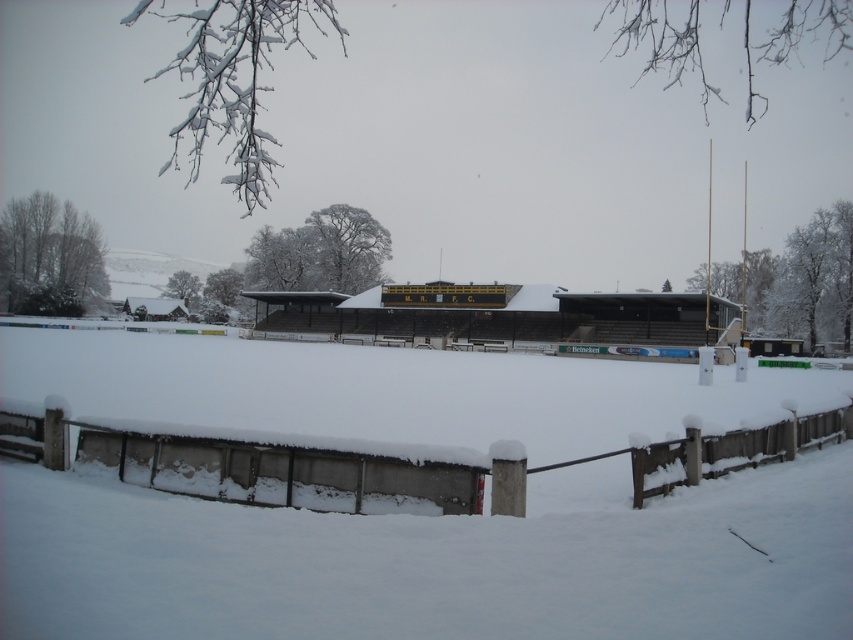
Question: Which object appears closest to the camera in this image?

Choices:
 (A) snow-covered wooden fence at lower center
 (B) dark brown wooden hut at center

Answer: (A)

Question: Is snow-covered wooden fence at lower center below dark brown wooden hut at center?

Choices:
 (A) yes
 (B) no

Answer: (A)

Question: Can you confirm if snow-covered wooden fence at lower center is bigger than dark brown wooden hut at center?

Choices:
 (A) yes
 (B) no

Answer: (B)

Question: Which of the following is the farthest from the observer?

Choices:
 (A) (270, 476)
 (B) (283, 316)

Answer: (B)

Question: Does snow-covered wooden fence at lower center appear over dark brown wooden hut at center?

Choices:
 (A) yes
 (B) no

Answer: (B)